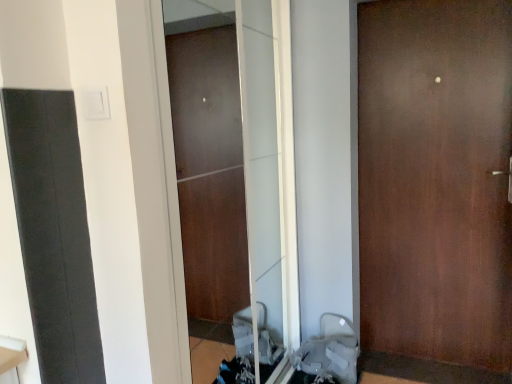
In order to face transparent glass screen door at center, should I rotate leftwards or rightwards?

Turn left by 0.128 degrees to look at transparent glass screen door at center.

Where is `gray fabric baby carriage at lower right`? The width and height of the screenshot is (512, 384). gray fabric baby carriage at lower right is located at coordinates (330, 350).

Is gray fabric baby carriage at lower right facing towards brown matte door at center?

No.

Is gray fabric baby carriage at lower right positioned far away from brown matte door at center?

That's not correct — gray fabric baby carriage at lower right is a little close to brown matte door at center.

Is brown matte door at center inside gray fabric baby carriage at lower right?

No, gray fabric baby carriage at lower right does not contain brown matte door at center.

Is point (320, 320) behind point (506, 189)?

That is True.

In terms of size, does brown matte door at center appear bigger or smaller than gray fabric baby carriage at lower right?

In the image, brown matte door at center appears to be larger than gray fabric baby carriage at lower right.

Which object is thinner, brown matte door at center or gray fabric baby carriage at lower right?

brown matte door at center.

Is brown matte door at center positioned far away from gray fabric baby carriage at lower right?

That's not correct — brown matte door at center is a little close to gray fabric baby carriage at lower right.

Which point is more forward, (337, 343) or (262, 291)?

The point (337, 343) is closer.

Considering the sizes of gray fabric baby carriage at lower right and transparent glass screen door at center in the image, is gray fabric baby carriage at lower right taller or shorter than transparent glass screen door at center?

Considering their sizes, gray fabric baby carriage at lower right has less height than transparent glass screen door at center.

Could you tell me if gray fabric baby carriage at lower right is facing transparent glass screen door at center?

No.

Would you say gray fabric baby carriage at lower right is a long distance from transparent glass screen door at center?

That's not correct — gray fabric baby carriage at lower right is a little close to transparent glass screen door at center.

This screenshot has width=512, height=384. Identify the location of screen door located in front of the brown matte door at center. (267, 163).

Is transparent glass screen door at center bigger or smaller than brown matte door at center?

Clearly, transparent glass screen door at center is smaller in size than brown matte door at center.

Could you tell me if transparent glass screen door at center is turned towards brown matte door at center?

No, transparent glass screen door at center is not facing towards brown matte door at center.

From a real-world perspective, is transparent glass screen door at center physically above gray fabric baby carriage at lower right?

Correct, in the physical world, transparent glass screen door at center is higher than gray fabric baby carriage at lower right.

Find the location of a particular element. baby carriage lying below the transparent glass screen door at center (from the image's perspective) is located at coordinates (330, 350).

Is gray fabric baby carriage at lower right surrounded by transparent glass screen door at center?

No, gray fabric baby carriage at lower right is not a part of transparent glass screen door at center.

Would you say transparent glass screen door at center is to the left or to the right of gray fabric baby carriage at lower right in the picture?

transparent glass screen door at center is to the left of gray fabric baby carriage at lower right.

From the image's perspective, which is below, brown matte door at center or transparent glass screen door at center?

transparent glass screen door at center.

Where is `door on the right of transparent glass screen door at center`? The width and height of the screenshot is (512, 384). door on the right of transparent glass screen door at center is located at coordinates click(436, 179).

Is brown matte door at center oriented towards transparent glass screen door at center?

No, brown matte door at center is not facing towards transparent glass screen door at center.

Which object is more forward, brown matte door at center or transparent glass screen door at center?

transparent glass screen door at center.

This screenshot has width=512, height=384. In order to click on baby carriage on the left of brown matte door at center in this screenshot , I will do `click(330, 350)`.

The width and height of the screenshot is (512, 384). In the image, there is a brown matte door at center. What are the coordinates of `baby carriage below it (from a real-world perspective)` in the screenshot? It's located at (330, 350).

Consider the image. Considering their positions, is transparent glass screen door at center positioned closer to brown matte door at center than gray fabric baby carriage at lower right?

The object closer to brown matte door at center is transparent glass screen door at center.

Based on their spatial positions, is transparent glass screen door at center or brown matte door at center closer to gray fabric baby carriage at lower right?

Based on the image, transparent glass screen door at center appears to be nearer to gray fabric baby carriage at lower right.

Looking at the image, which one is located further to transparent glass screen door at center, brown matte door at center or gray fabric baby carriage at lower right?

brown matte door at center lies further to transparent glass screen door at center than the other object.

Consider the image. Based on their spatial positions, is gray fabric baby carriage at lower right or transparent glass screen door at center closer to brown matte door at center?

The object closer to brown matte door at center is transparent glass screen door at center.

Based on their spatial positions, is brown matte door at center or transparent glass screen door at center further from gray fabric baby carriage at lower right?

Based on the image, brown matte door at center appears to be further to gray fabric baby carriage at lower right.

Based on their spatial positions, is gray fabric baby carriage at lower right or brown matte door at center further from transparent glass screen door at center?

brown matte door at center.

Locate an element on the screen. The width and height of the screenshot is (512, 384). baby carriage located between transparent glass screen door at center and brown matte door at center in the left-right direction is located at coordinates (330, 350).